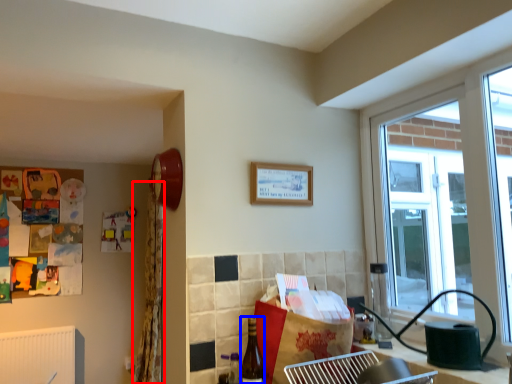
Question: Which object appears farthest to the camera in this image, curtain (highlighted by a red box) or bottle (highlighted by a blue box)?

Choices:
 (A) curtain
 (B) bottle

Answer: (A)